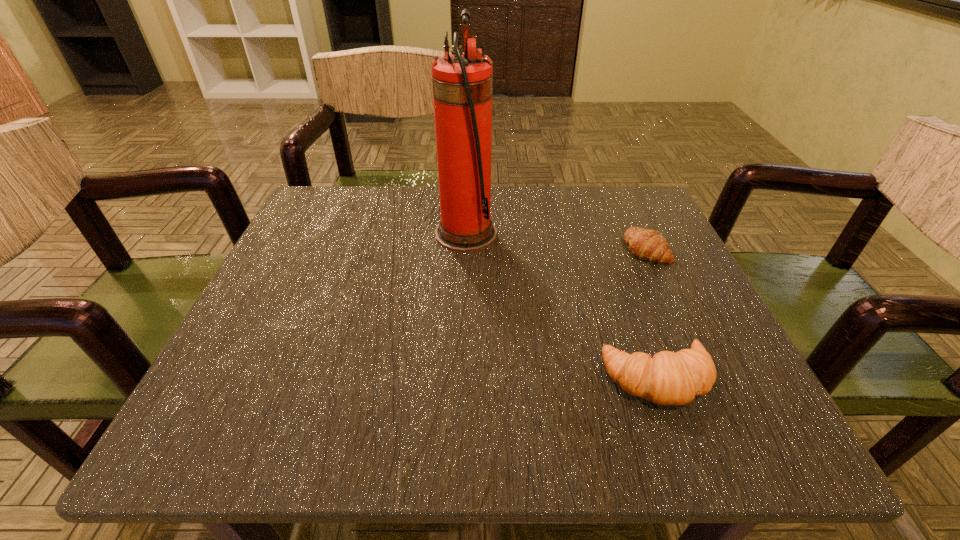
Identify the location of the tallest object. The width and height of the screenshot is (960, 540). (462, 84).

This screenshot has width=960, height=540. Find the location of `fire extinguisher`. fire extinguisher is located at coordinates (462, 84).

Locate an element on the screen. The image size is (960, 540). the nearer crescent roll is located at coordinates (669, 378).

Where is `the second tallest object`? Image resolution: width=960 pixels, height=540 pixels. the second tallest object is located at coordinates (669, 378).

The width and height of the screenshot is (960, 540). In order to click on the shortest object in this screenshot , I will do 645,244.

Where is `the shorter crescent roll`? Image resolution: width=960 pixels, height=540 pixels. the shorter crescent roll is located at coordinates point(645,244).

Locate an element on the screen. Image resolution: width=960 pixels, height=540 pixels. blank area located 0.310m at the discharge end of the leftmost object is located at coordinates (x=650, y=233).

Locate an element on the screen. This screenshot has height=540, width=960. blank space located 0.150m on the left of the second tallest object is located at coordinates (499, 379).

Where is `vacant space positioned on the back of the farther crescent roll`? The image size is (960, 540). vacant space positioned on the back of the farther crescent roll is located at coordinates (623, 201).

In order to click on fire extinguisher that is at the far edge in this screenshot , I will do `click(462, 84)`.